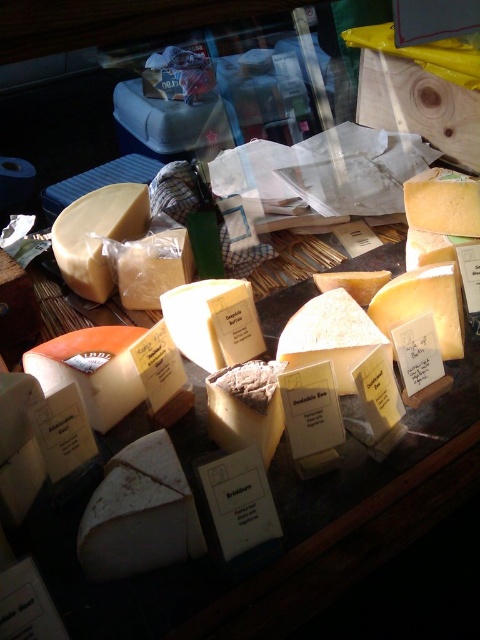
Question: Estimate the real-world distances between objects in this image. Which object is closer to the golden hard cheese at center?

Choices:
 (A) matte yellow cheese at center
 (B) yellow semi-hard cheese at center

Answer: (B)

Question: Does yellow semi-hard cheese at center have a larger size compared to matte yellow cheese at center?

Choices:
 (A) no
 (B) yes

Answer: (B)

Question: Estimate the real-world distances between objects in this image. Which object is closer to the matte yellow cheese at center?

Choices:
 (A) yellow semi-hard cheese at center
 (B) golden hard cheese at center

Answer: (A)

Question: Estimate the real-world distances between objects in this image. Which object is farther from the yellow semi-hard cheese at center?

Choices:
 (A) matte yellow cheese at center
 (B) golden hard cheese at center

Answer: (A)

Question: Does yellow semi-hard cheese at center have a larger size compared to golden hard cheese at center?

Choices:
 (A) yes
 (B) no

Answer: (A)

Question: Does matte yellow cheese at center have a smaller size compared to golden hard cheese at center?

Choices:
 (A) no
 (B) yes

Answer: (A)